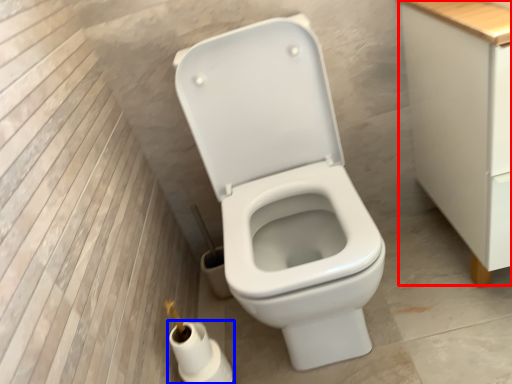
Question: Which point is further to the camera, cabinetry (highlighted by a red box) or toilet paper (highlighted by a blue box)?

Choices:
 (A) cabinetry
 (B) toilet paper

Answer: (B)